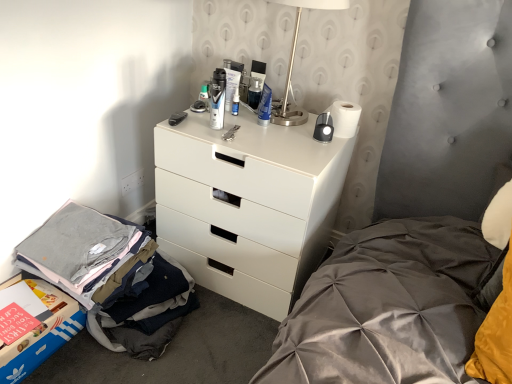
You are a GUI agent. You are given a task and a screenshot of the screen. Output one action in this format:
    pyautogui.click(x=<x>, y=<y>)
    Task: Click on the free spot in front of matte black shaving cream can at center, marked as the second toiletry in a left-to-right arrangement
    This screenshot has height=384, width=512.
    Given the screenshot: What is the action you would take?
    pyautogui.click(x=215, y=140)